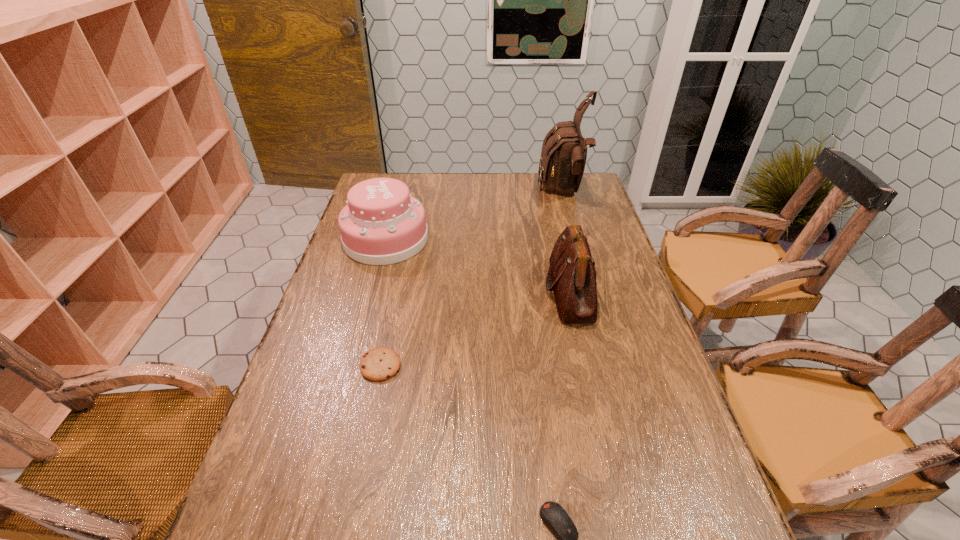
This screenshot has width=960, height=540. I want to click on vacant space located 0.330m on the right of the cookie, so click(x=534, y=366).

Where is `object that is at the far edge`? The height and width of the screenshot is (540, 960). object that is at the far edge is located at coordinates (564, 151).

Where is `birthday cake at the left edge`? This screenshot has width=960, height=540. birthday cake at the left edge is located at coordinates (382, 224).

This screenshot has width=960, height=540. Find the location of `cookie present at the left edge`. cookie present at the left edge is located at coordinates (379, 364).

Where is `object present at the far right corner`? object present at the far right corner is located at coordinates (564, 151).

Locate an element on the screen. free point at the far edge is located at coordinates (416, 180).

This screenshot has width=960, height=540. What are the coordinates of `free region at the left edge of the desktop` in the screenshot? It's located at (329, 434).

Locate an element on the screen. The height and width of the screenshot is (540, 960). free space at the right edge of the desktop is located at coordinates (629, 309).

The height and width of the screenshot is (540, 960). Identify the location of unoccupied position between the farther shoulder bag and the second nearest object. (472, 279).

At what (x,y) coordinates should I click in order to perform the action: click on unoccupied area between the fourth farthest object and the taller shoulder bag. Please return your answer as a coordinate pair (x, y). This screenshot has height=540, width=960. Looking at the image, I should click on (472, 279).